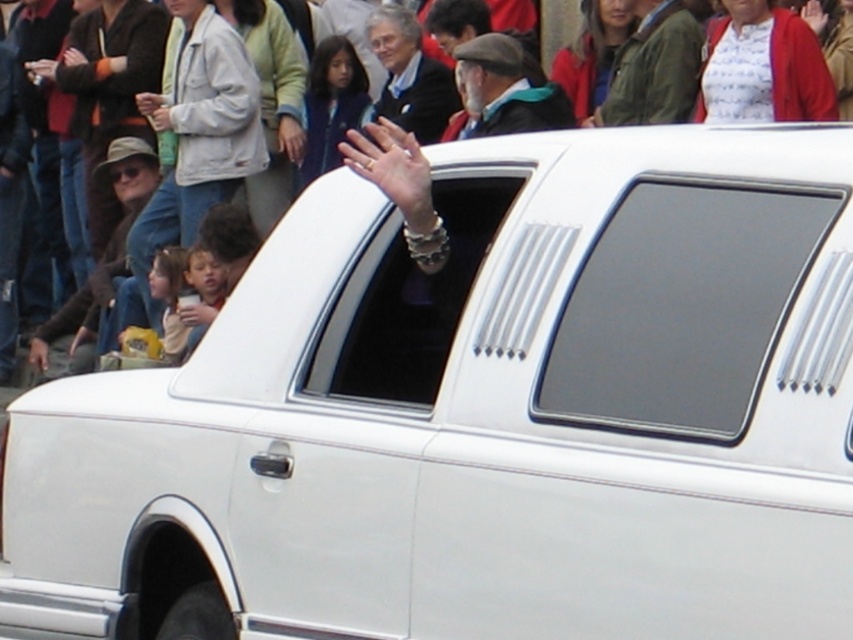
You are standing at the origin point of the coordinate system. You want to walk to point point [714,312]. However, there is an obstacle at point point [10,289]. Can you walk straight to your destination without going around the obstacle?

Point [714,312] is in front of point 0.452, 0.14, so you can walk straight to the destination without going around the obstacle.

In the scene with the white limousine, there are two items of clothing visible. The first is a green textured jacket at upper center and the second is a gray wool hat at center. Which clothing item is positioned to the right of the other?

The green textured jacket at upper center is to the right of the gray wool hat at center.

You are a photographer at the scene and want to capture both the green textured jacket at upper center and the gray wool hat at center in a single photo. Considering their sizes, which object should you focus on to ensure both are clearly visible in the frame?

The green textured jacket at upper center is larger than the gray wool hat at center, so focusing on the green textured jacket at upper center will help ensure both are clearly visible in the frame.